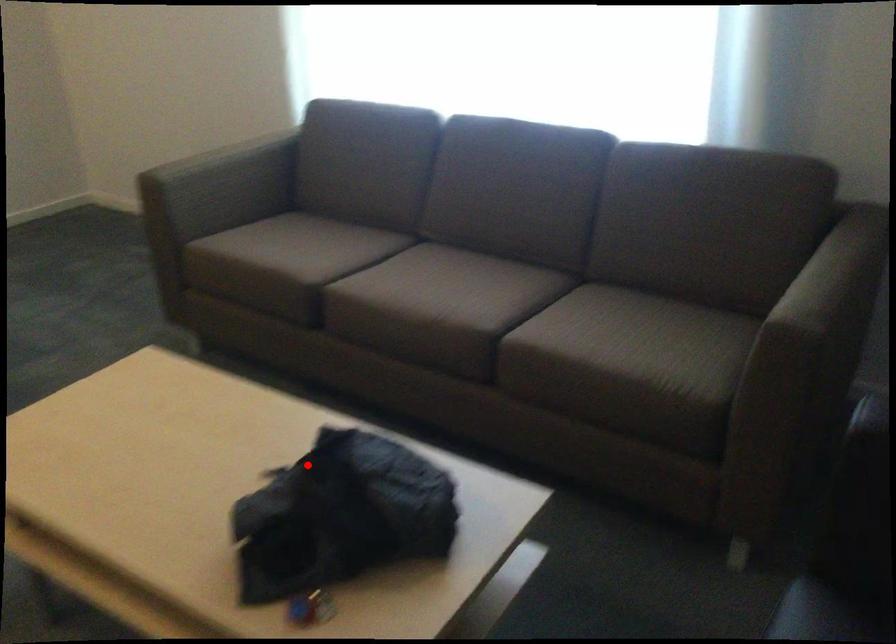
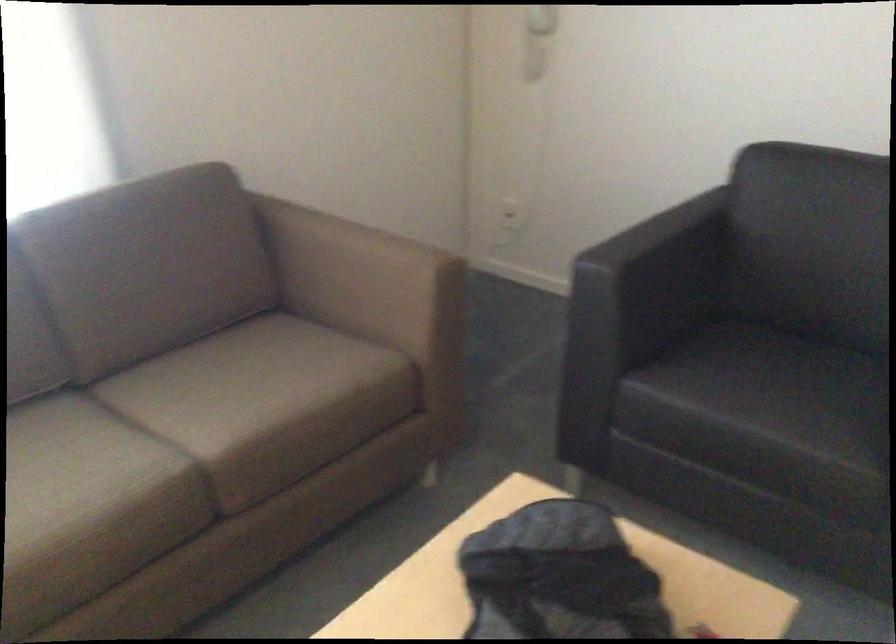
Question: I am providing you with two images of the same scene from different viewpoints. In image1, a red point is highlighted. Considering the same 3D point in image2, which of the following is correct?

Choices:
 (A) It is closer
 (B) It is farther

Answer: (A)